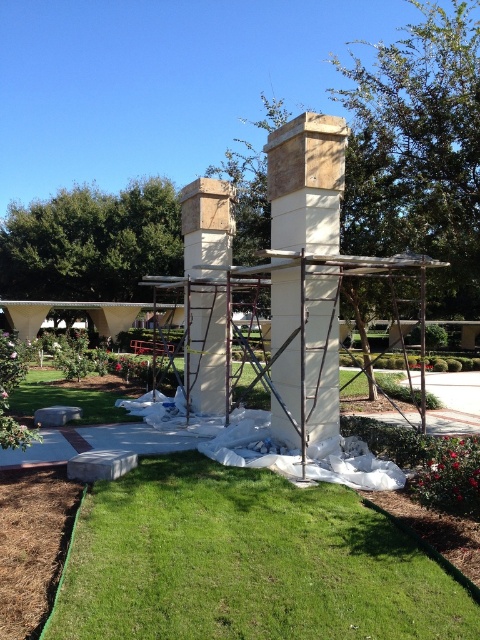
Question: Can you confirm if green grass at lower center is positioned to the left of beige stone gazebo at center?

Choices:
 (A) yes
 (B) no

Answer: (B)

Question: Can you confirm if beige stone gazebo at center is thinner than beige stone chimney at center?

Choices:
 (A) yes
 (B) no

Answer: (A)

Question: Which point appears farthest from the camera in this image?

Choices:
 (A) (439, 572)
 (B) (271, 218)

Answer: (B)

Question: Is green grass at lower center smaller than beige stone chimney at center?

Choices:
 (A) yes
 (B) no

Answer: (A)

Question: Estimate the real-world distances between objects in this image. Which object is farther from the beige stone gazebo at center?

Choices:
 (A) beige stone chimney at center
 (B) green grass at lower center

Answer: (B)

Question: Which object is positioned closest to the green grass at lower center?

Choices:
 (A) beige stone gazebo at center
 (B) beige stone chimney at center

Answer: (B)